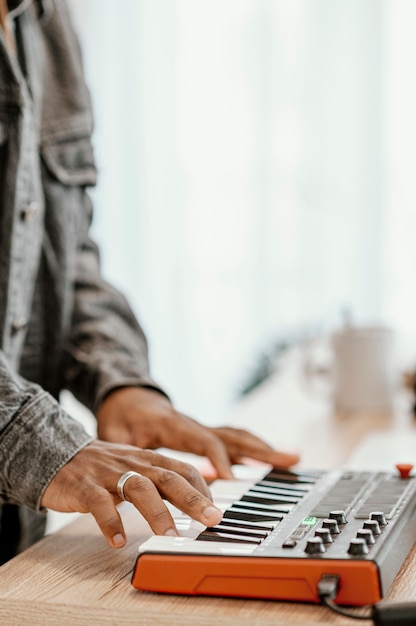
Where is `electronic keyboard adjuster knobs`? Image resolution: width=416 pixels, height=626 pixels. electronic keyboard adjuster knobs is located at coordinates (315, 546), (325, 535), (329, 526), (337, 515), (359, 548), (363, 536), (371, 524), (377, 516), (402, 467).